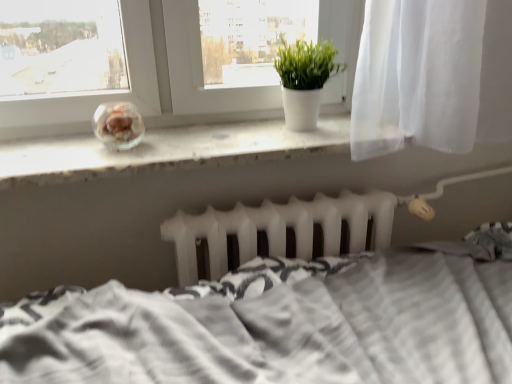
Locate an element on the screen. The image size is (512, 384). space that is in front of green matte plant at center is located at coordinates (290, 142).